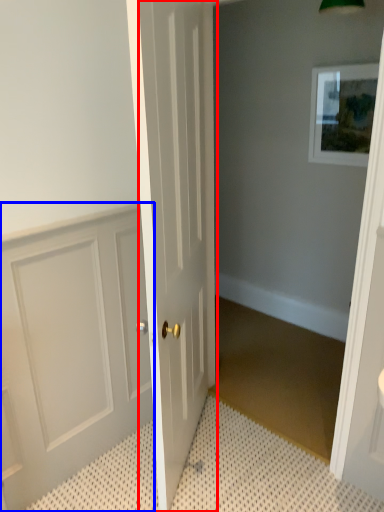
Question: Which point is further to the camera, door (highlighted by a red box) or door (highlighted by a blue box)?

Choices:
 (A) door
 (B) door

Answer: (B)